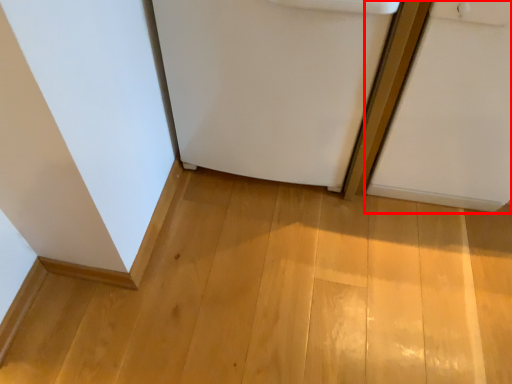
Question: From the image, what is the correct spatial relationship of door (annotated by the red box) in relation to refrigerator?

Choices:
 (A) left
 (B) right

Answer: (B)